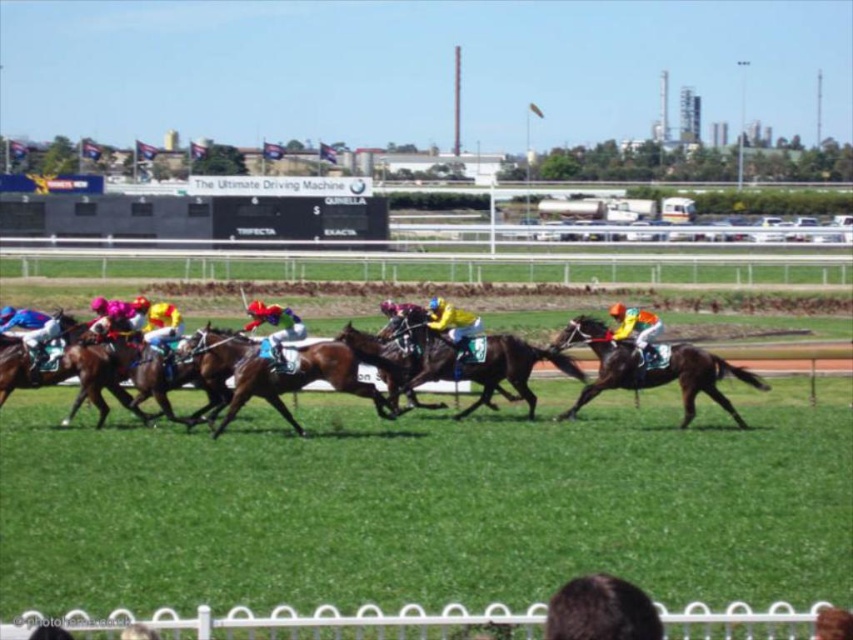
You are a spectator at the horse race and want to know the position of the horses relative to each other. Which horse is positioned to the right of the other between the brown glossy horse at center and the black glossy horse at center?

The brown glossy horse at center is positioned to the right of the black glossy horse at center.

You are a photographer positioned at the starting line of the horse race. You want to capture a closeup shot of the brown glossy horse at center. Given that your camera has a maximum zoom range of 20 meters, will you be able to focus on the horse?

The brown glossy horse at center is 20.75 meters away from the camera. Since the camera can only zoom up to 20 meters, it cannot reach the required distance. Therefore, you won t be able to focus on the horse with the current camera settings.

You are a photographer positioned at the origin point of the image. You want to capture a closeup of the yellow matte helmet at center. Which direction should you move your camera to focus on it?

The yellow matte helmet at center is located at coordinates 0.516 on the x axis and 0.746 on the y axis. Since the origin is at the bottom left corner, you should move your camera to the right and upwards to focus on it.